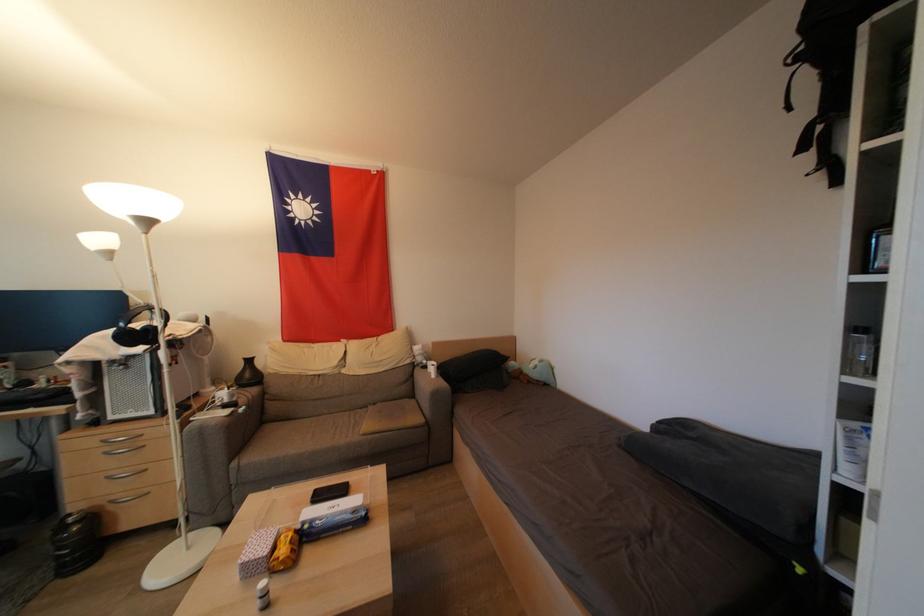
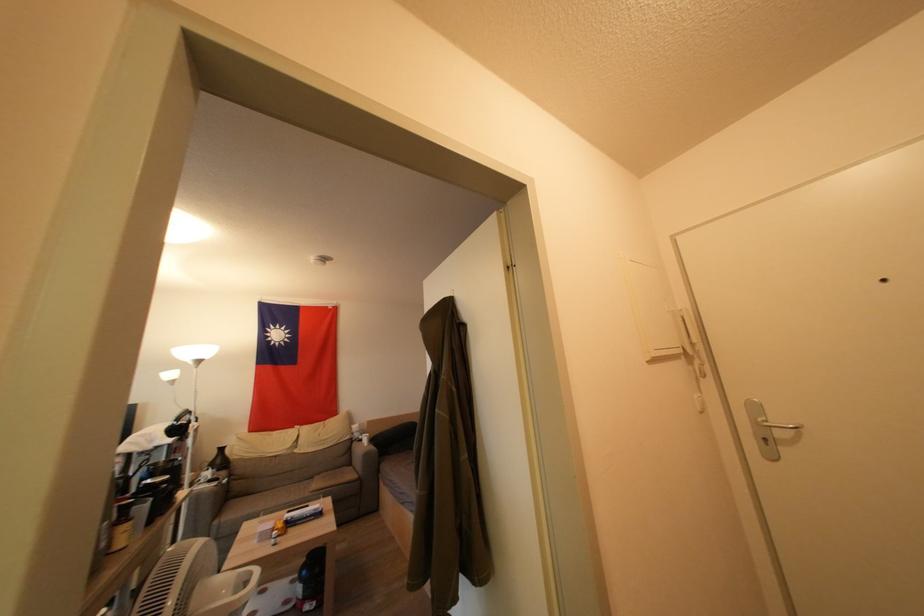
Locate, in the second image, the point that corresponds to the point at 252,379 in the first image.

(224, 464)